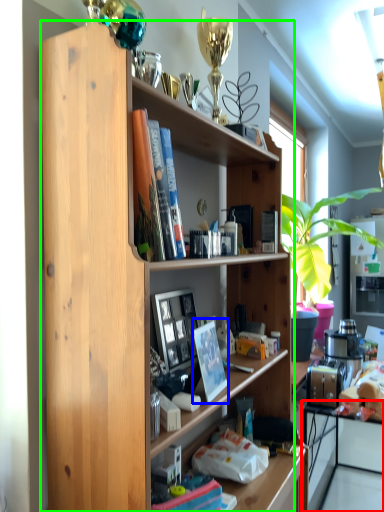
Question: Based on their relative distances, which object is farther from computer (highlighted by a red box)? Choose from paperback book (highlighted by a blue box) and shelf (highlighted by a green box).

Choices:
 (A) paperback book
 (B) shelf

Answer: (A)